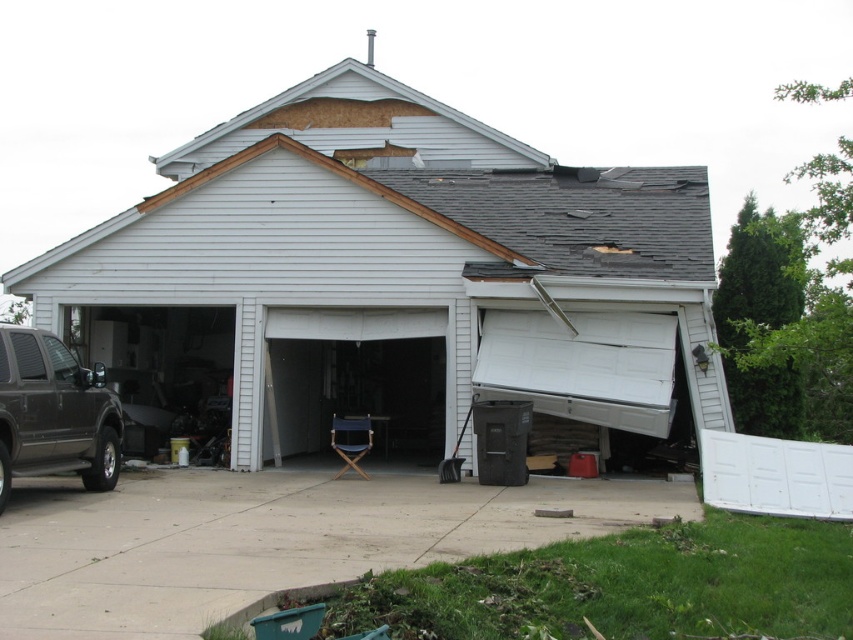
You are a delivery person trying to reach the garage door. You are currently standing on the concrete at lower center. Which direction should you move to reach the white matte garage door at center?

The concrete at lower center is behind the white matte garage door at center, so you should move forward towards the white matte garage door at center to reach it.

You are a delivery person trying to park your van, which is 5 meters long, on the driveway. The van needs to be parked parallel to the driveway. The driveway has the white matte garage door at center and concrete at lower center. Can you fit your van between these two objects without overlapping them?

The distance between the white matte garage door at center and the concrete at lower center is 4.79 meters. Since the van is 5 meters long, it cannot fit within this space as the required length exceeds the available distance by 0.21 meters.